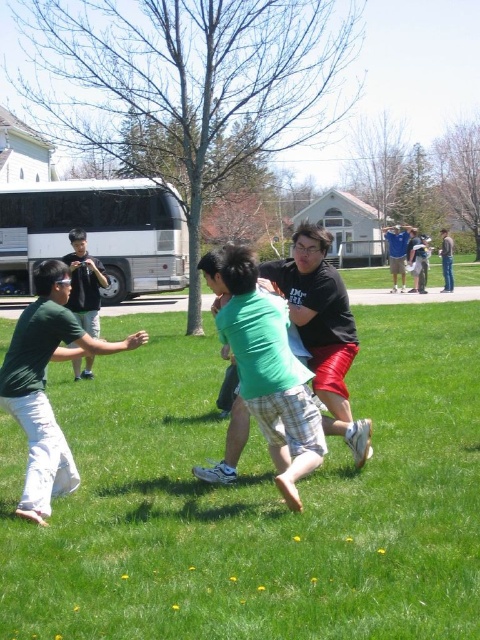
Is point (377, 525) positioned in front of point (448, 259)?

Yes.

Is green grass at center below denim jeans at right?

Indeed, green grass at center is positioned under denim jeans at right.

Which is in front, point (343, 586) or point (452, 260)?

Point (343, 586) is more forward.

In order to click on green grass at center in this screenshot , I will do `click(255, 500)`.

Who is shorter, green cotton shirt at center or denim jeans at right?

With less height is green cotton shirt at center.

Where is `green cotton shirt at center`? green cotton shirt at center is located at coordinates (322, 328).

The image size is (480, 640). Identify the location of green cotton shirt at center. (322, 328).

Looking at this image, does white matte tour bus at left have a greater width compared to green cotton shirt at center?

Incorrect, white matte tour bus at left's width does not surpass green cotton shirt at center's.

Where is `white matte tour bus at left`? white matte tour bus at left is located at coordinates (96, 234).

Locate an element on the screen. This screenshot has height=640, width=480. white matte tour bus at left is located at coordinates (96, 234).

You are a GUI agent. You are given a task and a screenshot of the screen. Output one action in this format:
    pyautogui.click(x=<x>, y=<y>)
    Task: Click on the white matte tour bus at left
    The image size is (480, 640).
    Given the screenshot: What is the action you would take?
    pyautogui.click(x=96, y=234)